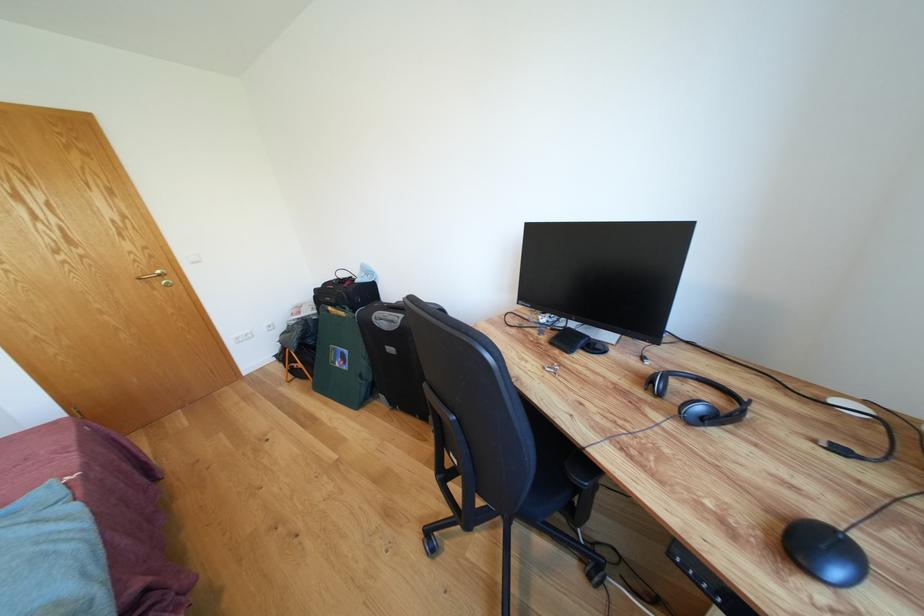
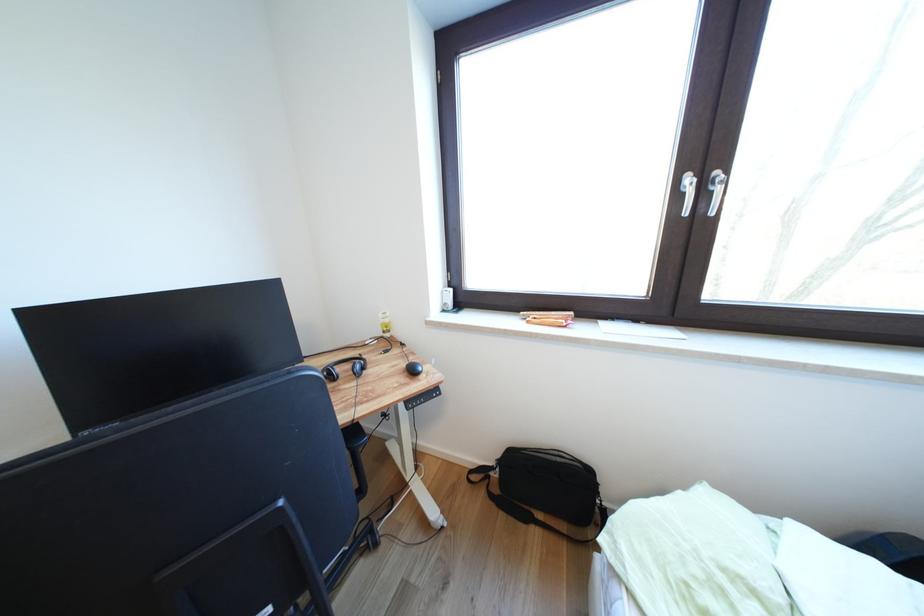
Question: The images are taken continuously from a first-person perspective. In which direction is your viewpoint rotating?

Choices:
 (A) Left
 (B) Right
 (C) Up
 (D) Down

Answer: (B)